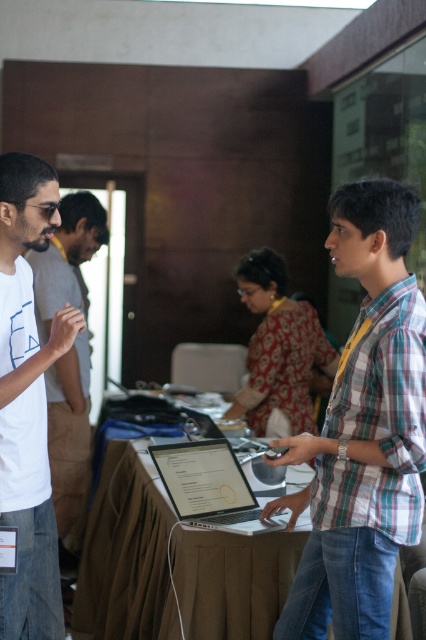
You are standing in the room and want to reach the point marked as point (351,611). If you take a step forward of 1.5 meters, will you reach it?

The point (351,611) is 2.00 meters away from the camera, so stepping forward 1.5 meters would leave you 0.5 meters short. You need to move an additional 0.5 meters to reach it.